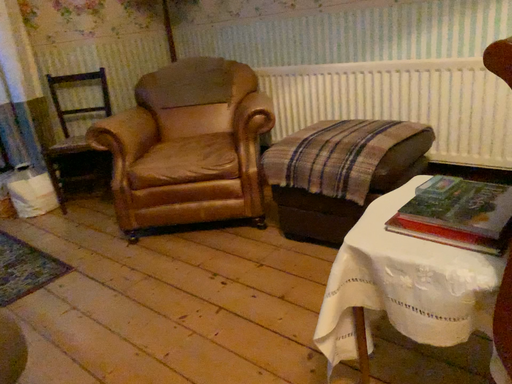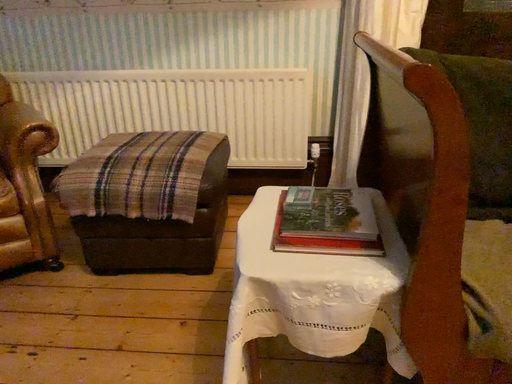
Question: How did the camera likely rotate when shooting the video?

Choices:
 (A) rotated right
 (B) rotated left

Answer: (A)